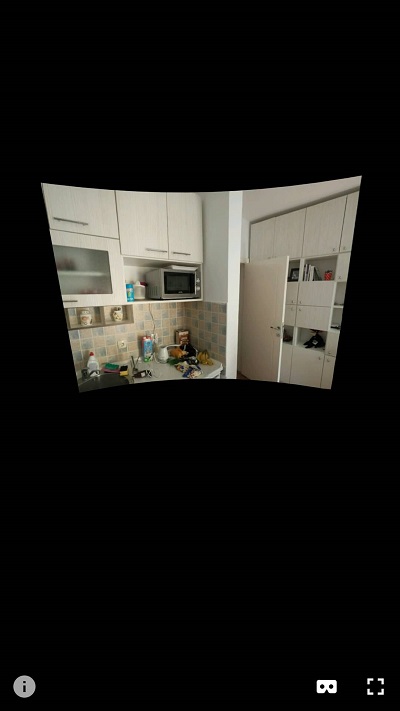
Locate an element on the screen. This screenshot has width=400, height=711. wooden floor is located at coordinates (240, 375).